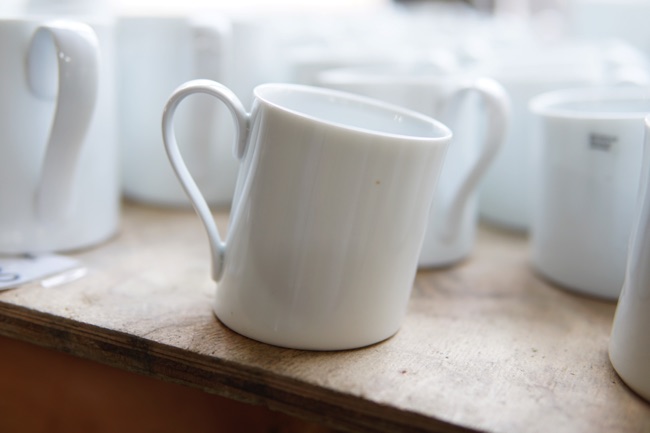
This screenshot has width=650, height=433. Find the location of `white coffee mugs`. white coffee mugs is located at coordinates (322, 210), (23, 110), (153, 76), (429, 97), (599, 172), (515, 171), (630, 297).